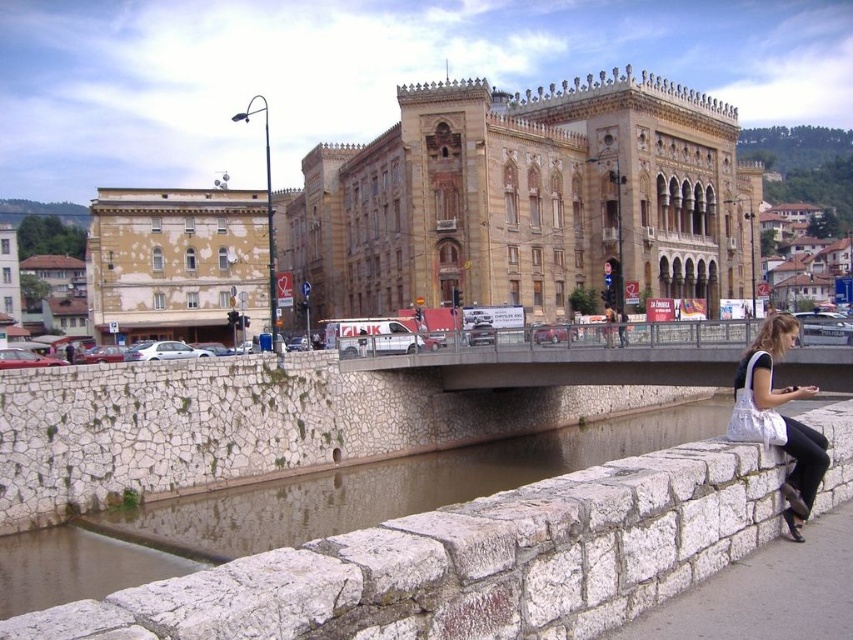
Question: Does concrete bridge at center appear over white fabric bag at lower right?

Choices:
 (A) yes
 (B) no

Answer: (A)

Question: Estimate the real-world distances between objects in this image. Which object is farther from the yellowish beige stone building at left?

Choices:
 (A) white fabric bag at lower right
 (B) concrete bridge at center

Answer: (A)

Question: Among these points, which one is nearest to the camera?

Choices:
 (A) (103, 241)
 (B) (787, 481)

Answer: (B)

Question: Can you confirm if concrete bridge at center is positioned below white fabric bag at lower right?

Choices:
 (A) no
 (B) yes

Answer: (A)

Question: Based on their relative distances, which object is nearer to the concrete bridge at center?

Choices:
 (A) white fabric bag at lower right
 (B) yellowish beige stone building at left

Answer: (A)

Question: Is yellowish beige stone building at left in front of concrete bridge at center?

Choices:
 (A) yes
 (B) no

Answer: (B)